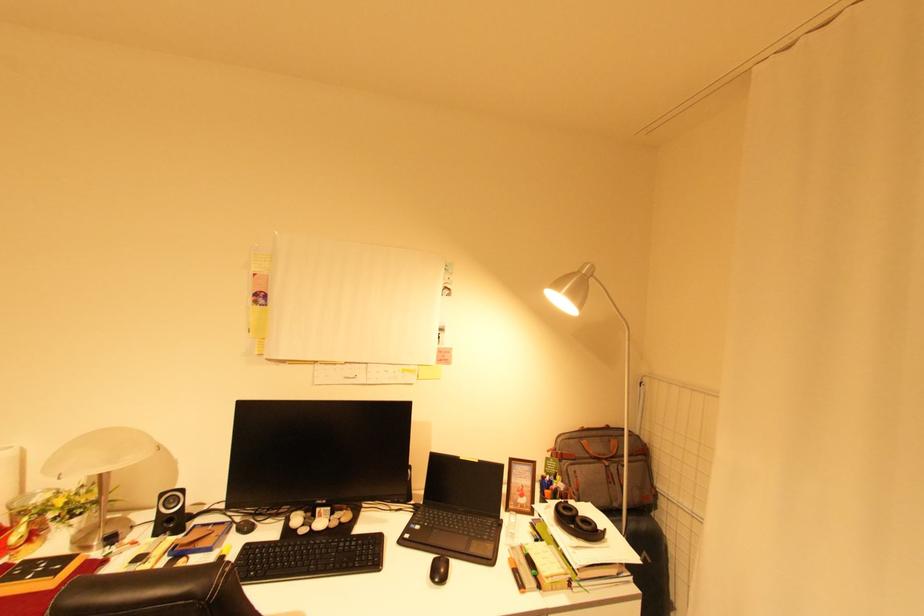
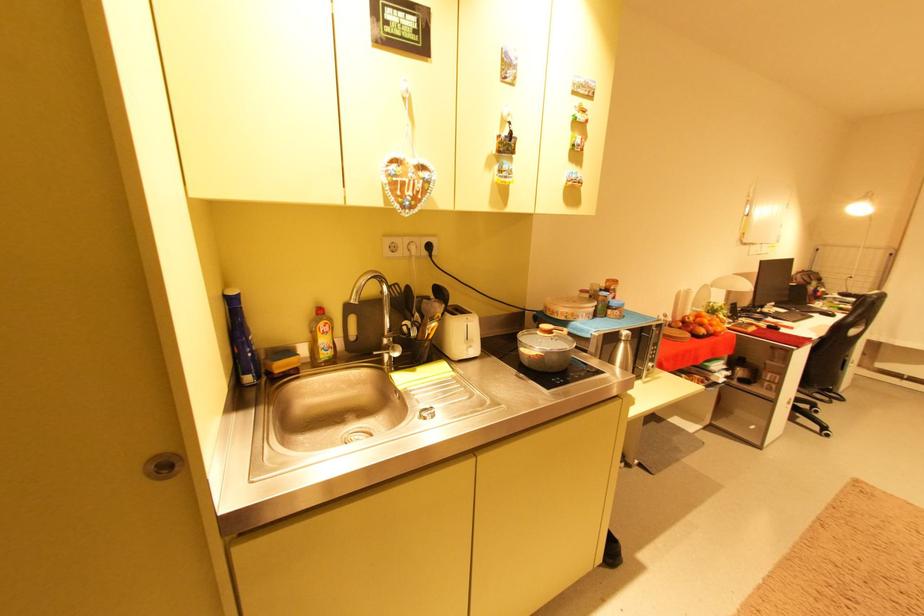
Question: In a continuous first-person perspective shot, in which direction is the camera moving?

Choices:
 (A) Left
 (B) Right
 (C) Forward
 (D) Backward

Answer: (A)